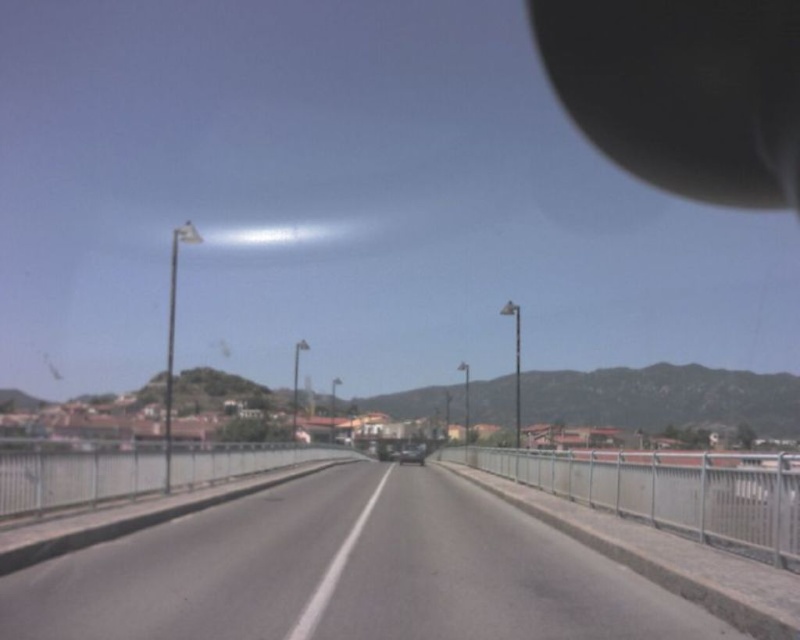
Between gray asphalt highway at center and matte black view mirror at upper right, which one is positioned lower?

gray asphalt highway at center is lower down.

Is the position of gray asphalt highway at center less distant than that of matte black view mirror at upper right?

Yes, it is.

Is point (680, 632) positioned behind point (790, 125)?

No, (680, 632) is in front of (790, 125).

At what (x,y) coordinates should I click in order to perform the action: click on gray asphalt highway at center. Please return your answer as a coordinate pair (x, y). This screenshot has height=640, width=800. Looking at the image, I should click on (348, 572).

Does point (782, 1) lie in front of point (408, 458)?

Yes, it is.

Locate an element on the screen. This screenshot has width=800, height=640. matte black view mirror at upper right is located at coordinates (684, 90).

You are a GUI agent. You are given a task and a screenshot of the screen. Output one action in this format:
    pyautogui.click(x=<x>, y=<y>)
    Task: Click on the matte black view mirror at upper right
    This screenshot has height=640, width=800.
    Given the screenshot: What is the action you would take?
    pyautogui.click(x=684, y=90)

Locate an element on the screen. gray asphalt highway at center is located at coordinates pyautogui.click(x=348, y=572).

Between gray asphalt highway at center and metallic silver car at center, which one has less height?

gray asphalt highway at center

Does point (304, 618) come behind point (405, 449)?

No, (304, 618) is in front of (405, 449).

Locate an element on the screen. This screenshot has height=640, width=800. gray asphalt highway at center is located at coordinates click(x=348, y=572).